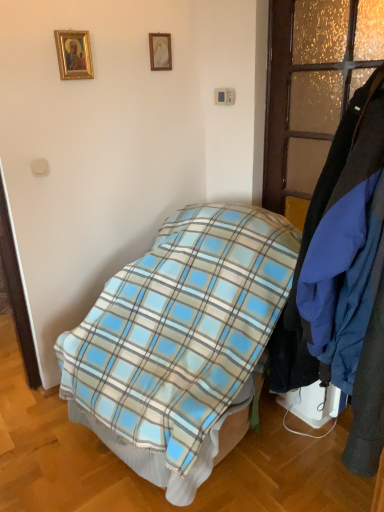
Question: In which direction should I rotate to look at matte gold picture frame at upper center, the first picture frame in the back-to-front sequence?

Choices:
 (A) right
 (B) left

Answer: (B)

Question: Is blue plaid blanket at center positioned beyond the bounds of translucent frosted glass door at right?

Choices:
 (A) yes
 (B) no

Answer: (A)

Question: Is blue plaid blanket at center smaller than translucent frosted glass door at right?

Choices:
 (A) no
 (B) yes

Answer: (A)

Question: Is blue plaid blanket at center thinner than translucent frosted glass door at right?

Choices:
 (A) yes
 (B) no

Answer: (B)

Question: Is blue plaid blanket at center facing away from translucent frosted glass door at right?

Choices:
 (A) no
 (B) yes

Answer: (A)

Question: Is blue plaid blanket at center shorter than translucent frosted glass door at right?

Choices:
 (A) no
 (B) yes

Answer: (A)

Question: Would you say blue plaid blanket at center contains translucent frosted glass door at right?

Choices:
 (A) no
 (B) yes

Answer: (A)

Question: Is blue plaid blanket at center in contact with blue fabric coat at right?

Choices:
 (A) yes
 (B) no

Answer: (B)

Question: Would you say blue fabric coat at right is part of blue plaid blanket at center's contents?

Choices:
 (A) yes
 (B) no

Answer: (B)

Question: Considering the relative sizes of blue plaid blanket at center and blue fabric coat at right in the image provided, is blue plaid blanket at center wider than blue fabric coat at right?

Choices:
 (A) no
 (B) yes

Answer: (B)

Question: Is the depth of blue plaid blanket at center less than that of blue fabric coat at right?

Choices:
 (A) no
 (B) yes

Answer: (B)

Question: Is blue plaid blanket at center further to the viewer compared to blue fabric coat at right?

Choices:
 (A) no
 (B) yes

Answer: (A)

Question: Does blue plaid blanket at center have a greater height compared to blue fabric coat at right?

Choices:
 (A) no
 (B) yes

Answer: (A)

Question: Can you confirm if gold-framed picture at upper left, which is the 2th picture frame in right-to-left order, is taller than blue fabric coat at right?

Choices:
 (A) yes
 (B) no

Answer: (B)